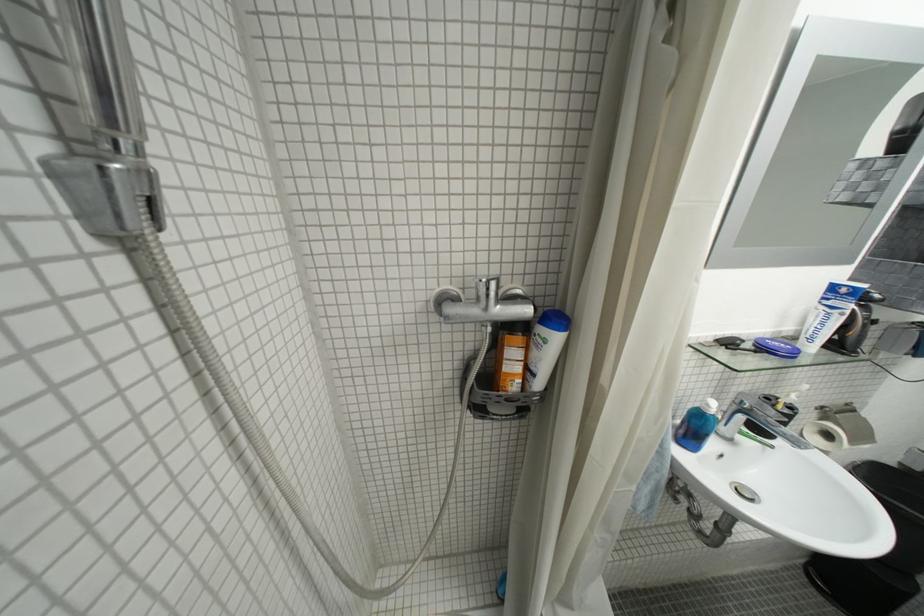
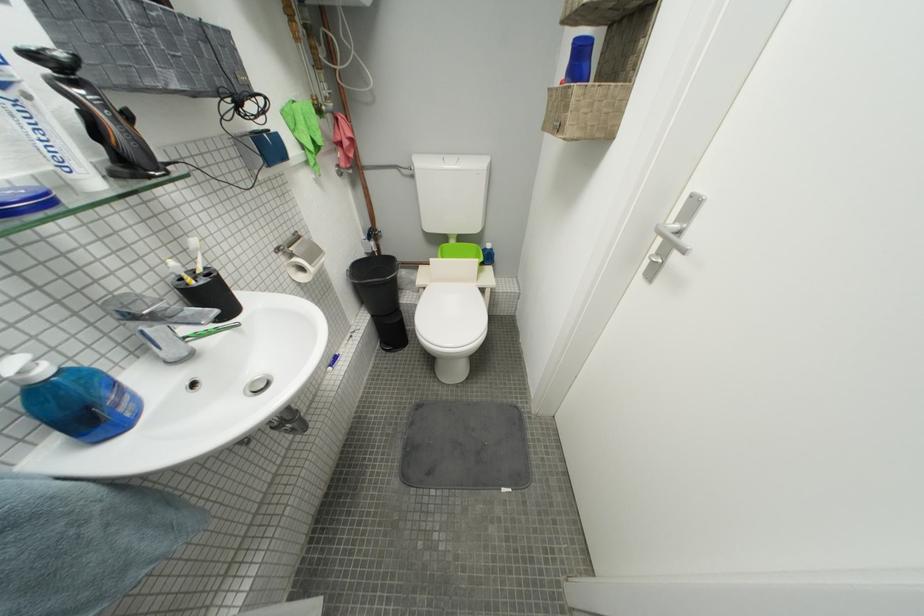
Locate, in the second image, the point that corresponds to (744,408) in the first image.

(139, 325)